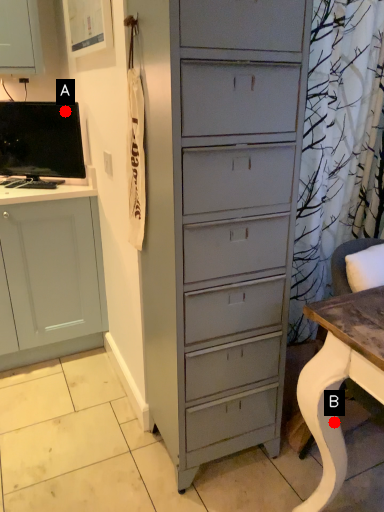
Question: Two points are circled on the image, labeled by A and B beside each circle. Which point appears farthest from the camera in this image?

Choices:
 (A) A is further
 (B) B is further

Answer: (A)